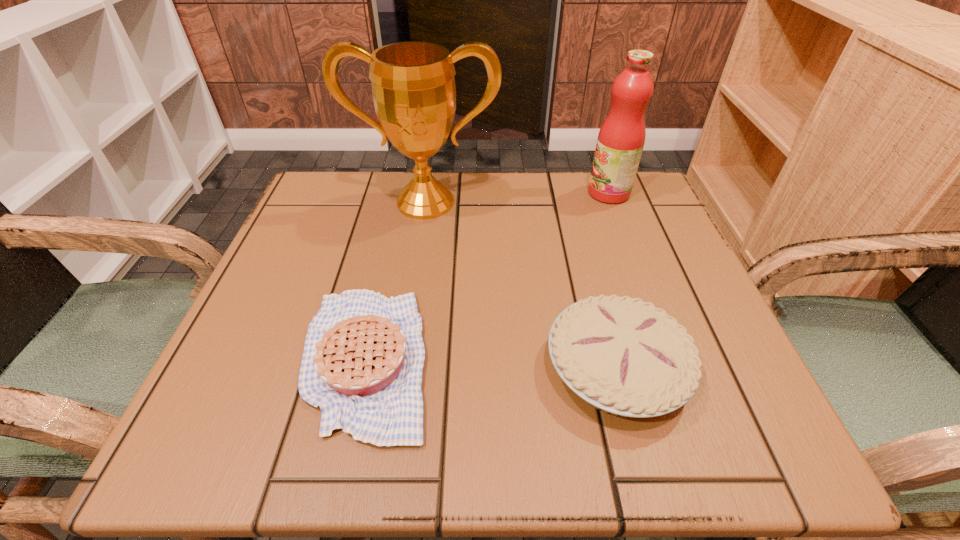
Where is `object that stands as the second closest to the taller pie`? Image resolution: width=960 pixels, height=540 pixels. object that stands as the second closest to the taller pie is located at coordinates (413, 86).

At what (x,y) coordinates should I click in order to perform the action: click on free space in the image that satisfies the following two spatial constraints: 1. on the front label of the fruit juice; 2. on the front-facing side of the award. Please return your answer as a coordinate pair (x, y). The image size is (960, 540). Looking at the image, I should click on 612,202.

At what (x,y) coordinates should I click in order to perform the action: click on vacant space that satisfies the following two spatial constraints: 1. on the front label of the fruit juice; 2. on the front side of the taller pie. Please return your answer as a coordinate pair (x, y). Looking at the image, I should click on (675, 368).

Image resolution: width=960 pixels, height=540 pixels. In order to click on free space that satisfies the following two spatial constraints: 1. on the front side of the left pie; 2. on the right side of the right pie in this screenshot , I will do `click(364, 368)`.

You are a GUI agent. You are given a task and a screenshot of the screen. Output one action in this format:
    pyautogui.click(x=<x>, y=<y>)
    Task: Click on the free region that satisfies the following two spatial constraints: 1. on the front side of the taller pie; 2. on the left side of the left pie
    
    Given the screenshot: What is the action you would take?
    pyautogui.click(x=364, y=368)